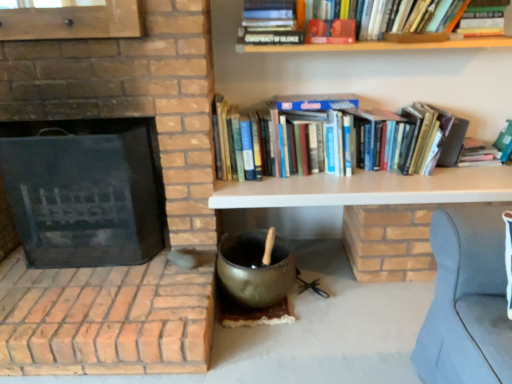
Image resolution: width=512 pixels, height=384 pixels. Find the location of `vacant area on top of white matte shelf at upper center (from a real-world perspective)`. vacant area on top of white matte shelf at upper center (from a real-world perspective) is located at coordinates (396, 181).